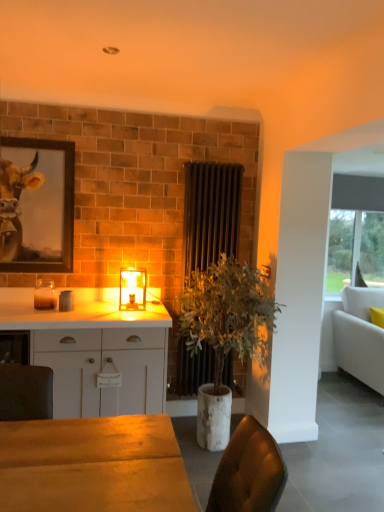
Question: Is point (52, 290) closer or farther from the camera than point (233, 167)?

Choices:
 (A) closer
 (B) farther

Answer: (A)

Question: Choose the correct answer: Is translucent glass candle at left inside black metal radiator at center or outside it?

Choices:
 (A) inside
 (B) outside

Answer: (B)

Question: Estimate the real-world distances between objects in this image. Which object is farther from the wooden framed painting at upper left?

Choices:
 (A) black metal radiator at center
 (B) translucent glass candle at left
 (C) white matte cabinet at center
 (D) white fabric couch at right
 (E) translucent glass lamp at center

Answer: (D)

Question: Which object is the farthest from the green leafy plant in concrete pot at center?

Choices:
 (A) wooden framed painting at upper left
 (B) translucent glass candle at left
 (C) white fabric couch at right
 (D) white matte cabinet at center
 (E) translucent glass lamp at center

Answer: (C)